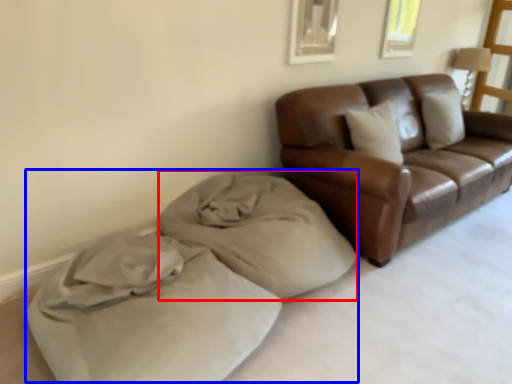
Question: Among these objects, which one is farthest to the camera, material (highlighted by a red box) or bed (highlighted by a blue box)?

Choices:
 (A) material
 (B) bed

Answer: (A)